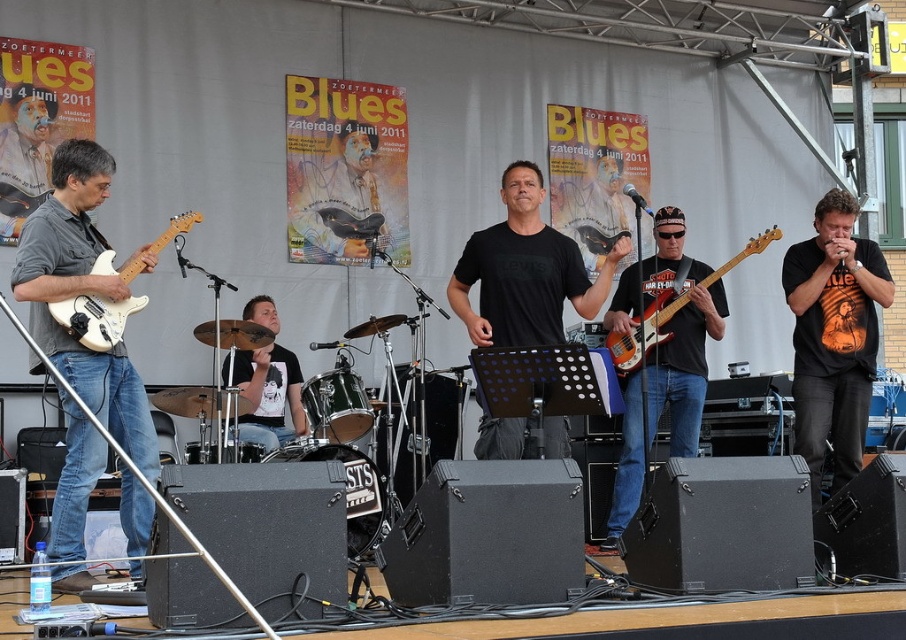
Question: Does orange printed t-shirt at right appear over matte red bass guitar at center?

Choices:
 (A) no
 (B) yes

Answer: (A)

Question: Which point is farther to the camera?

Choices:
 (A) matte black guitar at center
 (B) black t-shirt at center
 (C) matte white electric guitar at left

Answer: (B)

Question: Can you confirm if black t-shirt at center is bigger than matte white electric guitar at left?

Choices:
 (A) no
 (B) yes

Answer: (B)

Question: Which point is closer to the camera?

Choices:
 (A) matte white electric guitar at left
 (B) black t-shirt at center
 (C) black matte t-shirt at center

Answer: (A)

Question: Is matte black bass guitar at center below matte white electric guitar at left?

Choices:
 (A) no
 (B) yes

Answer: (B)

Question: Considering the real-world distances, which object is farthest from the matte white electric guitar at left?

Choices:
 (A) matte black bass guitar at center
 (B) matte black guitar at center
 (C) black t-shirt at center

Answer: (A)